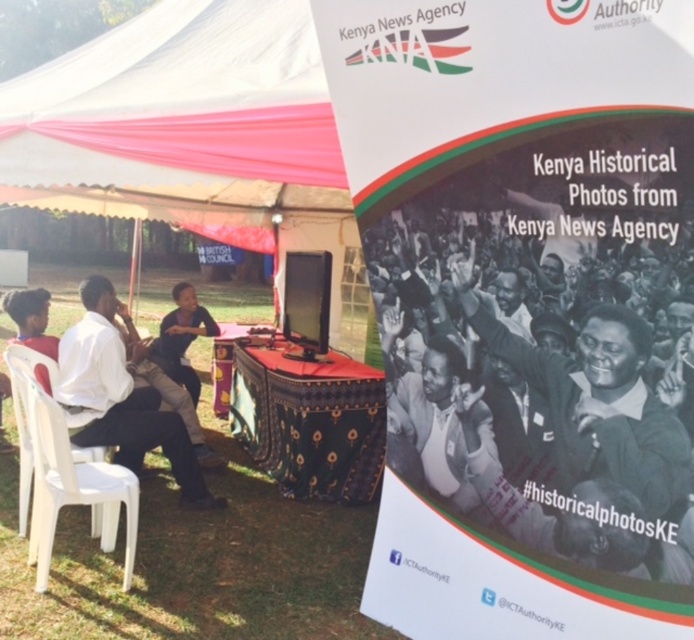
The image size is (694, 640). What do you see at coordinates (310, 422) in the screenshot?
I see `patterned fabric table at center` at bounding box center [310, 422].

Based on the photo, is patterned fabric table at center to the left of white matte shirt at left from the viewer's perspective?

Incorrect, patterned fabric table at center is not on the left side of white matte shirt at left.

Image resolution: width=694 pixels, height=640 pixels. In order to click on patterned fabric table at center in this screenshot , I will do `click(310, 422)`.

Does white plastic chair at left have a lesser height compared to dark brown skin at center?

Incorrect, white plastic chair at left's height does not fall short of dark brown skin at center's.

Which is in front, point (42, 365) or point (205, 321)?

Point (42, 365) is in front.

Image resolution: width=694 pixels, height=640 pixels. What do you see at coordinates (24, 417) in the screenshot? I see `white plastic chair at left` at bounding box center [24, 417].

Find the location of a particular element. The height and width of the screenshot is (640, 694). white plastic chair at left is located at coordinates 24,417.

Measure the distance between white matte shirt at left and camera.

white matte shirt at left is 3.58 meters from camera.

Who is positioned more to the right, white matte shirt at left or dark brown skin at center?

Positioned to the right is dark brown skin at center.

Which is in front, point (96, 364) or point (198, 316)?

Point (96, 364)

At what (x,y) coordinates should I click in order to perform the action: click on white matte shirt at left. Please return your answer as a coordinate pair (x, y). This screenshot has height=640, width=694. Looking at the image, I should click on (124, 396).